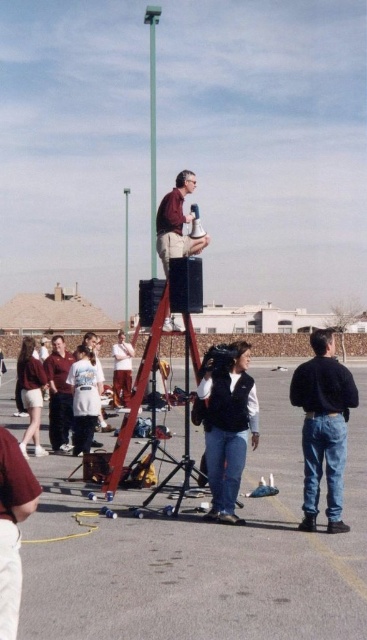
Question: Which object appears farthest from the camera in this image?

Choices:
 (A) denim vest at center
 (B) green metallic pole at center
 (C) smooth asphalt tarmac at center

Answer: (B)

Question: Does light blue jersey at center appear on the right side of light brown pants at center?

Choices:
 (A) no
 (B) yes

Answer: (B)

Question: Which object is positioned closest to the matte maroon hoodie at left?

Choices:
 (A) matte brown vest at center
 (B) jeans at lower right

Answer: (A)

Question: Does matte maroon hoodie at left have a smaller size compared to light brown pants at center?

Choices:
 (A) no
 (B) yes

Answer: (B)

Question: Which object appears farthest from the camera in this image?

Choices:
 (A) matte maroon hoodie at left
 (B) matte brown vest at center
 (C) light blue jersey at center

Answer: (C)

Question: From the image, what is the correct spatial relationship of jeans at lower right in relation to matte maroon hoodie at left?

Choices:
 (A) above
 (B) below

Answer: (B)